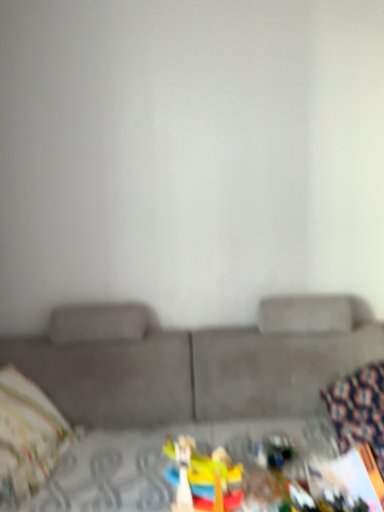
The image size is (384, 512). Identify the location of suede gray couch at center. (197, 364).

Image resolution: width=384 pixels, height=512 pixels. What do you see at coordinates (197, 364) in the screenshot? I see `suede gray couch at center` at bounding box center [197, 364].

Measure the distance between point (301, 346) and camera.

Point (301, 346) and camera are 7.23 feet apart.

Identify the location of suede gray couch at center. (197, 364).